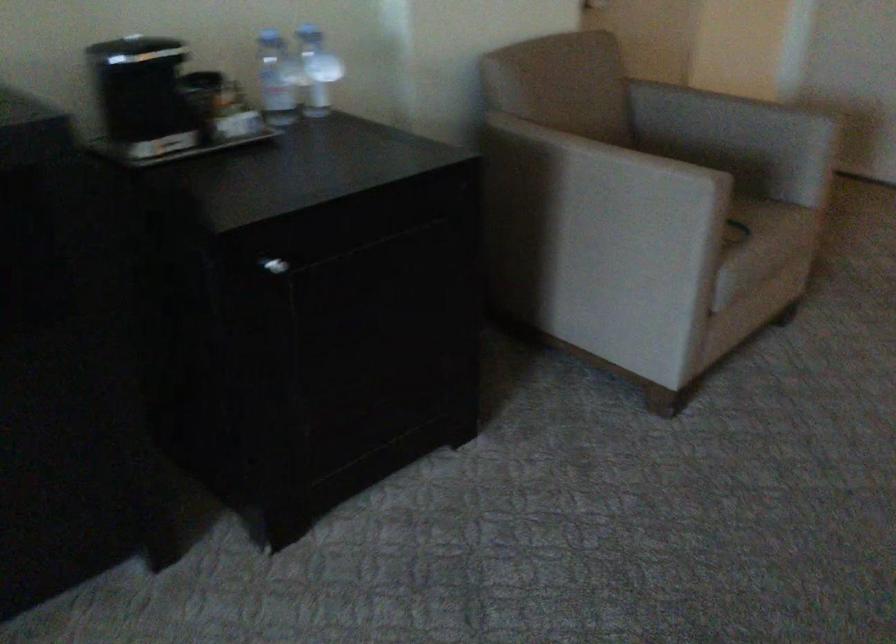
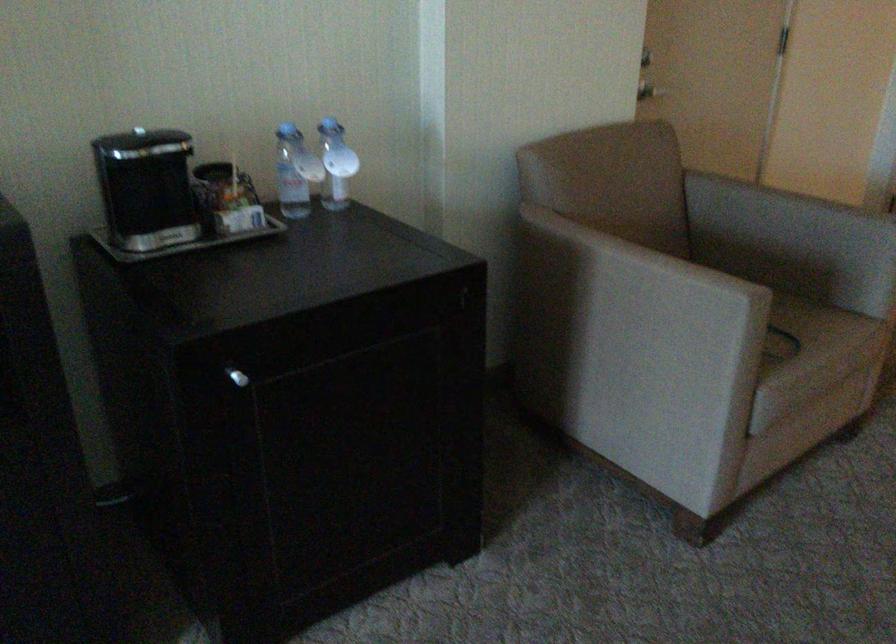
Find the pixel in the second image that matches (x=277, y=266) in the first image.

(237, 377)